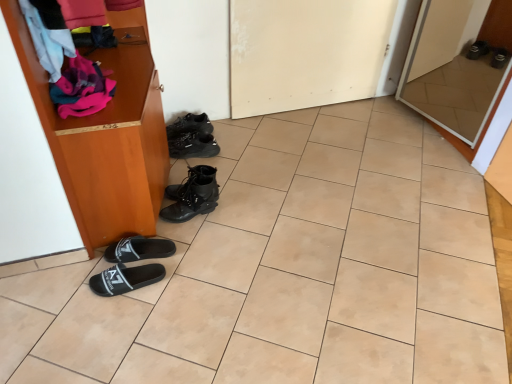
Where is `vacant space in front of black fabric slipper at lower left, which is the 5th footwear in top-to-bottom order`? vacant space in front of black fabric slipper at lower left, which is the 5th footwear in top-to-bottom order is located at coordinates (116, 324).